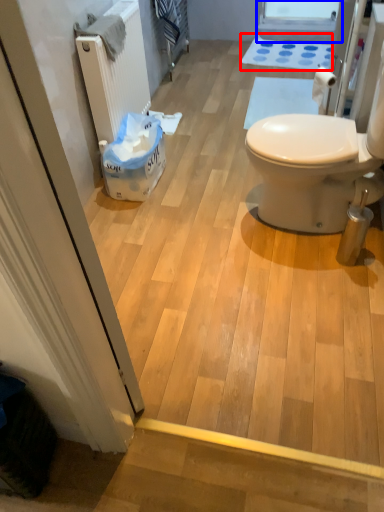
Question: Which object appears closest to the camera in this image, bath mat (highlighted by a red box) or window screen (highlighted by a blue box)?

Choices:
 (A) bath mat
 (B) window screen

Answer: (A)